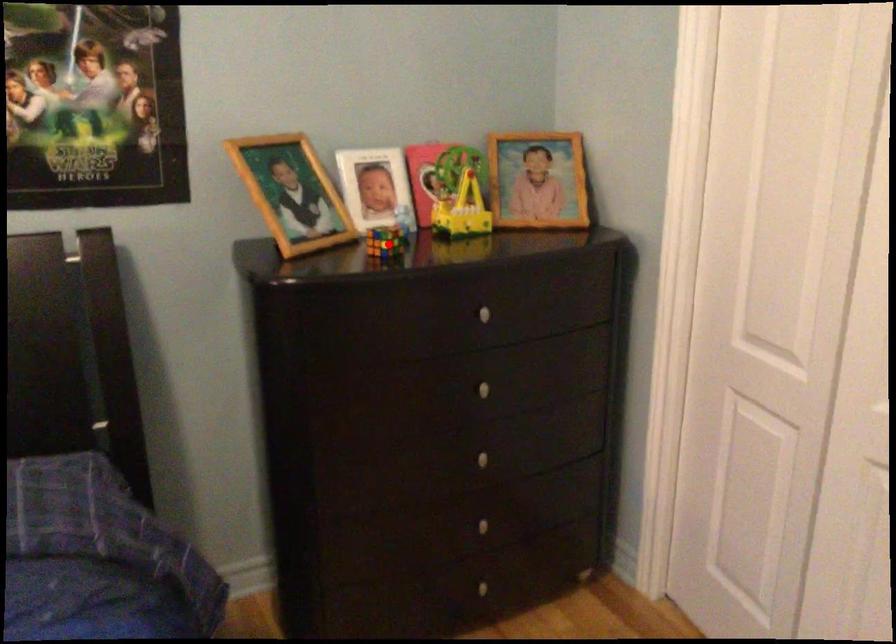
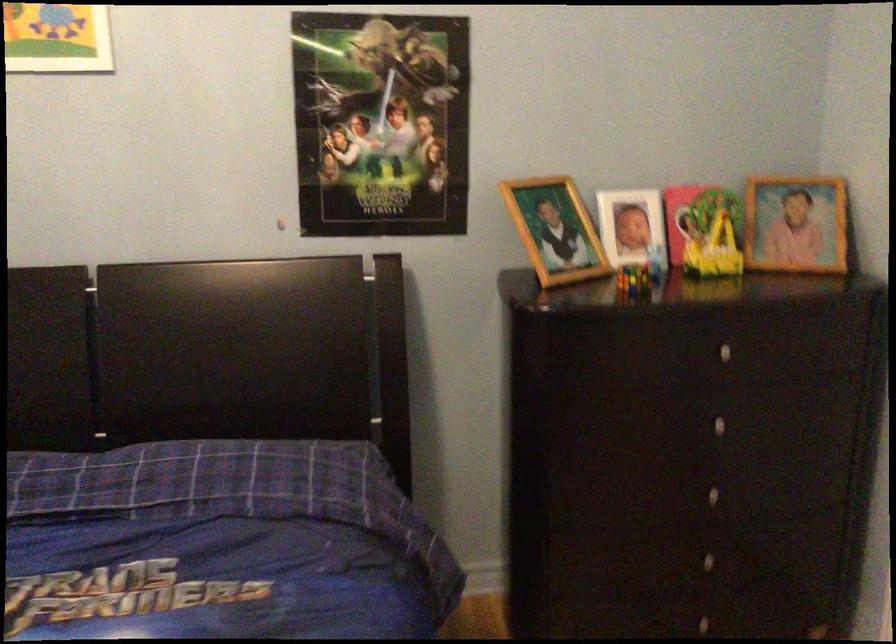
Locate, in the second image, the point that corresponds to the highlighted location in the first image.

(634, 279)